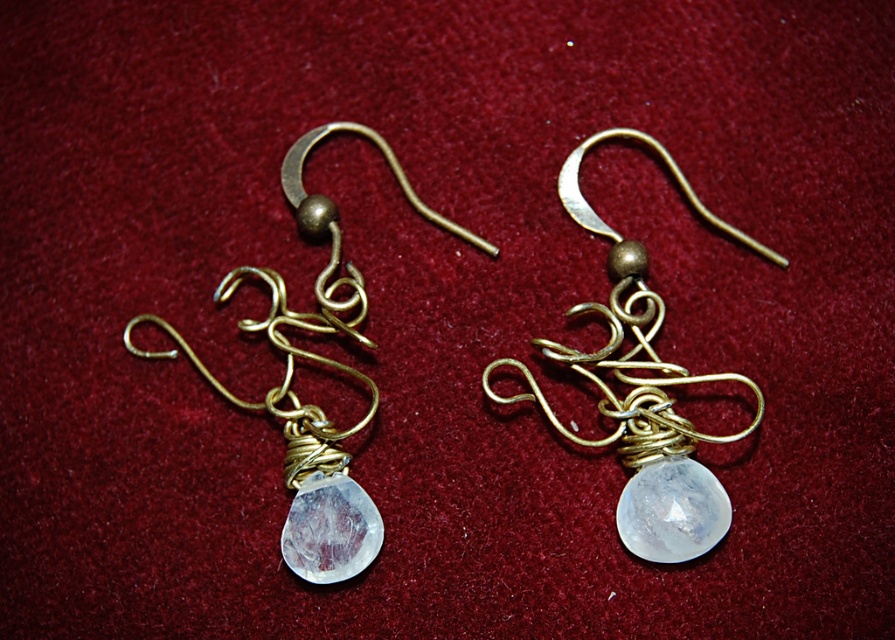
Question: Can you confirm if matte gold wire at center is wider than matte gold wire at left?

Choices:
 (A) yes
 (B) no

Answer: (B)

Question: Does matte gold wire at center appear over matte gold wire at left?

Choices:
 (A) no
 (B) yes

Answer: (B)

Question: Among these points, which one is farthest from the camera?

Choices:
 (A) (175, 356)
 (B) (646, 298)

Answer: (B)

Question: Is matte gold wire at center to the left of matte gold wire at left from the viewer's perspective?

Choices:
 (A) yes
 (B) no

Answer: (B)

Question: Which of the following is the farthest from the observer?

Choices:
 (A) (533, 397)
 (B) (372, 540)

Answer: (A)